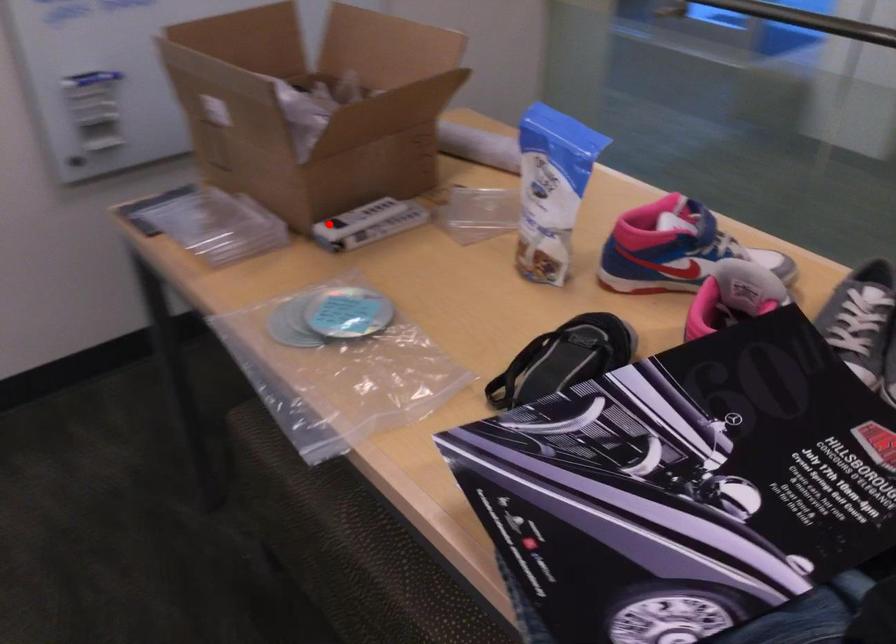
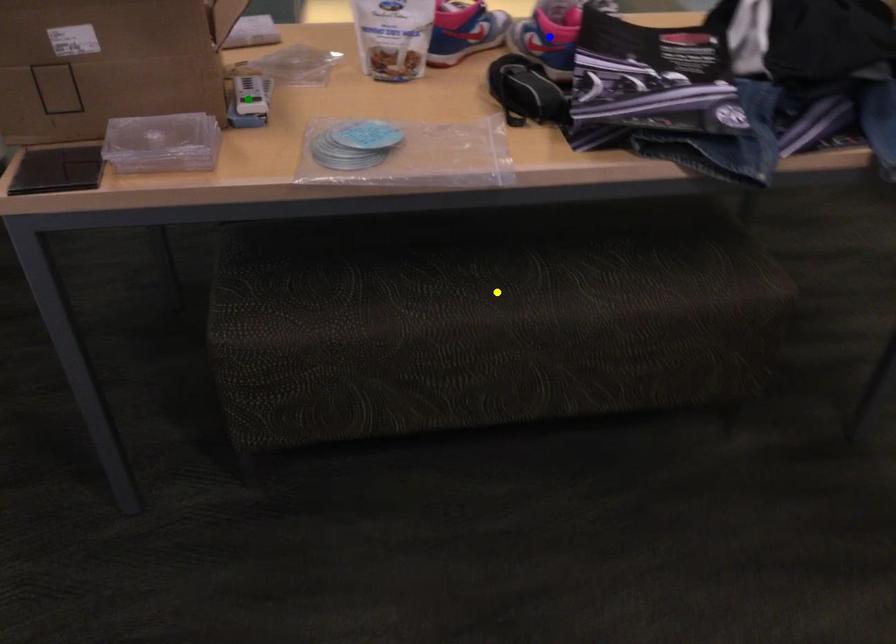
Question: I am providing you with two images of the same scene from different viewpoints. A red point is marked on the first image. You are given multiple points on the second image. Which point in image 2 is actually the same real-world point as the red point in image 1?

Choices:
 (A) blue point
 (B) yellow point
 (C) green point

Answer: (C)